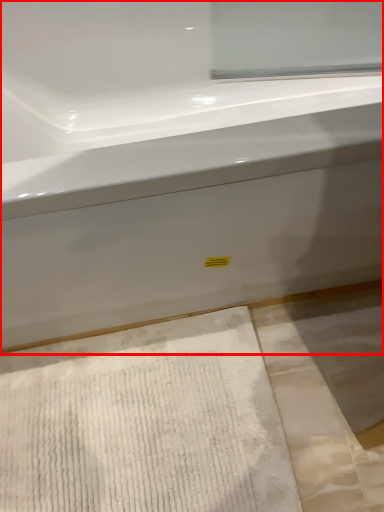
Question: From the image's perspective, what is the correct spatial positioning of bathtub (annotated by the red box) in reference to bath mat?

Choices:
 (A) above
 (B) below

Answer: (A)